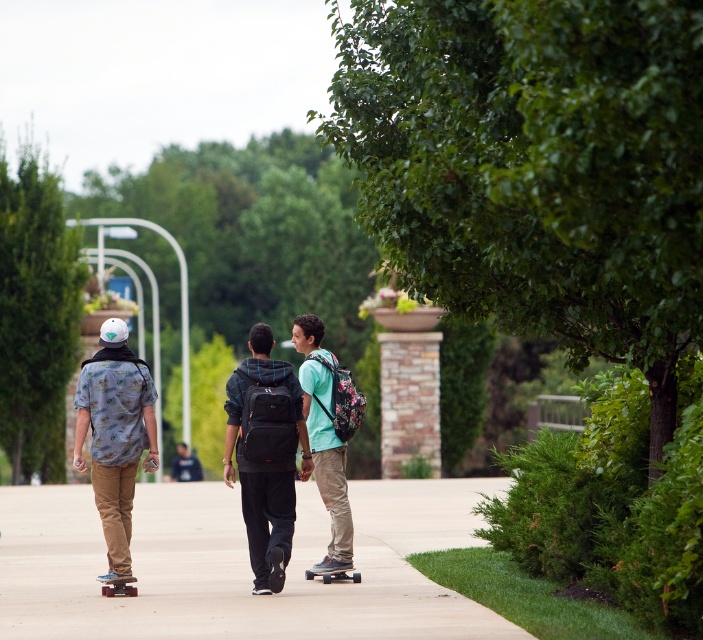
Question: Can you confirm if matte black skateboard at center is smaller than wooden skateboard at center?

Choices:
 (A) no
 (B) yes

Answer: (A)

Question: Which of these objects is positioned farthest from the floral-patterned backpack at center?

Choices:
 (A) floral-patterned shirt at left
 (B) black backpack at center

Answer: (A)

Question: Observing the image, what is the correct spatial positioning of floral-patterned backpack at center in reference to wooden skateboard at center?

Choices:
 (A) below
 (B) above

Answer: (B)

Question: Is wooden skateboard at center behind wooden smooth skateboard at center?

Choices:
 (A) yes
 (B) no

Answer: (B)

Question: Which point appears farthest from the camera in this image?

Choices:
 (A) (247, 625)
 (B) (103, 577)
 (C) (299, 336)
 (D) (352, 580)

Answer: (C)

Question: Which of these objects is positioned closest to the floral-patterned shirt at left?

Choices:
 (A) black backpack at center
 (B) wooden smooth skateboard at center
 (C) matte black skateboard at center

Answer: (C)